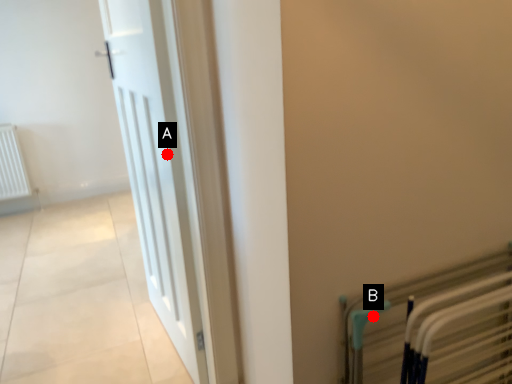
Question: Two points are circled on the image, labeled by A and B beside each circle. Which point is closer to the camera?

Choices:
 (A) A is closer
 (B) B is closer

Answer: (B)